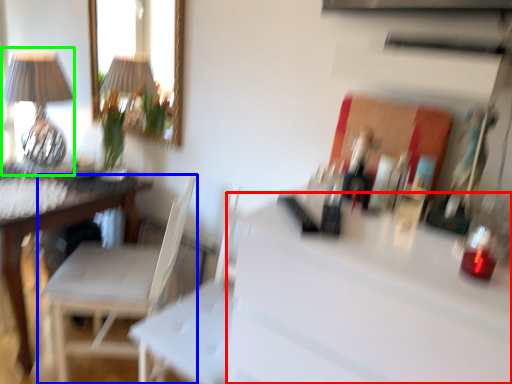
Question: Based on their relative distances, which object is nearer to counter top (highlighted by a red box)? Choose from chair (highlighted by a blue box) and table lamp (highlighted by a green box).

Choices:
 (A) chair
 (B) table lamp

Answer: (A)